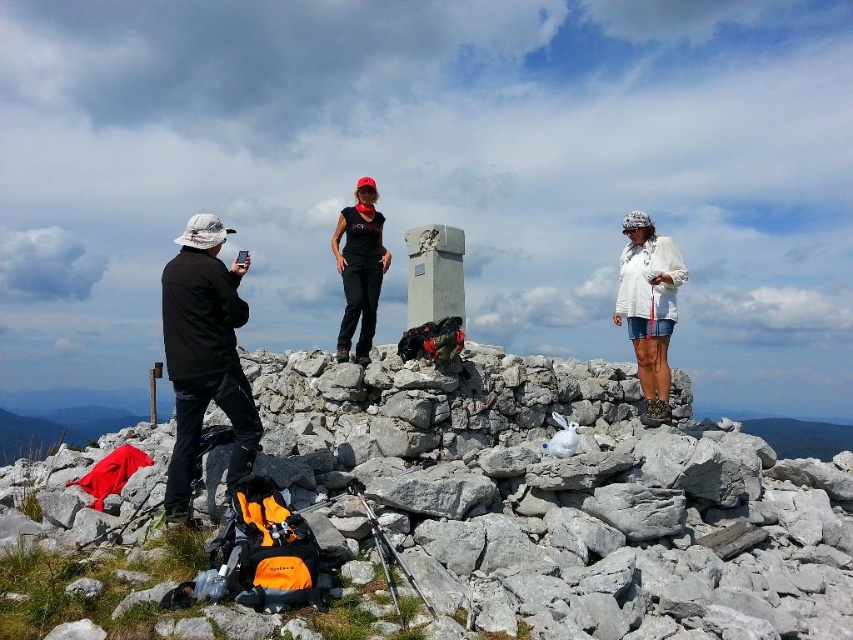
Question: Based on their relative distances, which object is nearer to the black matte shirt at center?

Choices:
 (A) gray stone mountain at center
 (B) white cotton shirt at upper right
 (C) black matte jacket at left

Answer: (C)

Question: Is gray stone mountain at center in front of black matte jacket at left?

Choices:
 (A) no
 (B) yes

Answer: (B)

Question: Does black matte jacket at left appear under black matte shirt at center?

Choices:
 (A) yes
 (B) no

Answer: (A)

Question: Which of the following is the farthest from the observer?

Choices:
 (A) black matte shirt at center
 (B) gray stone mountain at center
 (C) black matte jacket at left

Answer: (A)

Question: Is gray stone mountain at center positioned at the back of white cotton shirt at upper right?

Choices:
 (A) yes
 (B) no

Answer: (B)

Question: Which object is positioned farthest from the gray stone mountain at center?

Choices:
 (A) black matte shirt at center
 (B) white cotton shirt at upper right
 (C) black matte jacket at left

Answer: (B)